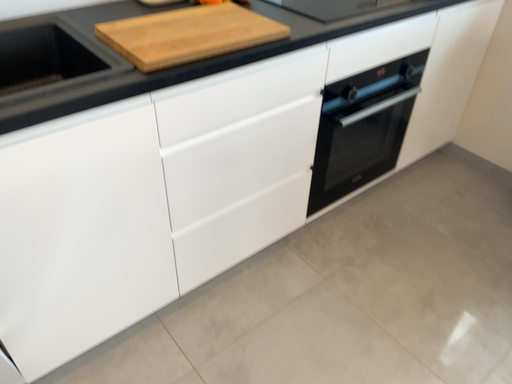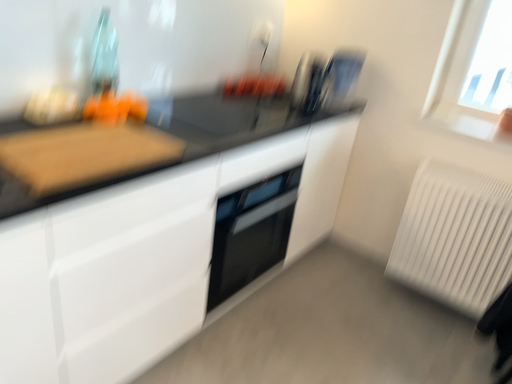
Question: How did the camera likely rotate when shooting the video?

Choices:
 (A) rotated right
 (B) rotated left

Answer: (A)